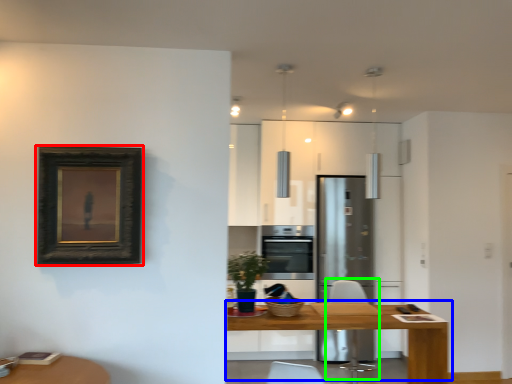
Question: Estimate the real-world distances between objects in this image. Which object is farther from picture frame (highlighted by a red box), table (highlighted by a blue box) or swivel chair (highlighted by a green box)?

Choices:
 (A) table
 (B) swivel chair

Answer: (B)